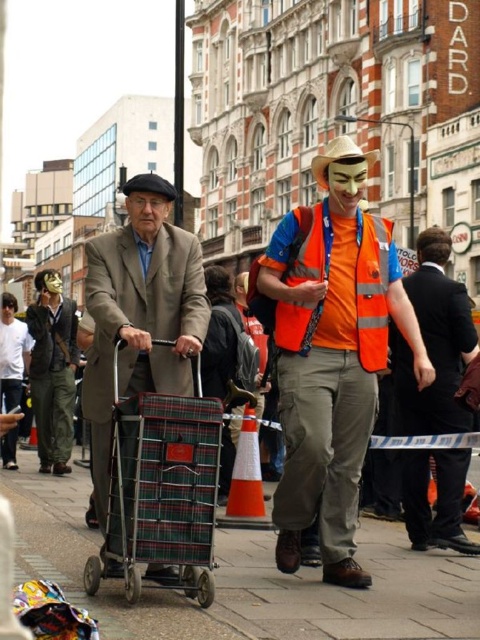
Who is higher up, orange reflective vest at center or matte black mask at lower left?

Positioned higher is matte black mask at lower left.

Does orange reflective vest at center have a greater height compared to matte black mask at lower left?

Correct, orange reflective vest at center is much taller as matte black mask at lower left.

Describe the element at coordinates (433, 342) in the screenshot. I see `orange reflective vest at center` at that location.

Identify the location of orange reflective vest at center. The height and width of the screenshot is (640, 480). (433, 342).

Does matte black mask at center have a larger size compared to matte orange mask at center?

Indeed, matte black mask at center has a larger size compared to matte orange mask at center.

Between matte black mask at center and matte orange mask at center, which one is positioned higher?

matte orange mask at center is higher up.

Describe the element at coordinates (52, 371) in the screenshot. The width and height of the screenshot is (480, 640). I see `matte black mask at center` at that location.

Find the location of a particular element. The height and width of the screenshot is (640, 480). matte black mask at center is located at coordinates pyautogui.click(x=52, y=371).

Does plaid fabric shopping cart at center appear on the right side of orange reflective vest at center?

In fact, plaid fabric shopping cart at center is to the left of orange reflective vest at center.

Which of these two, plaid fabric shopping cart at center or orange reflective vest at center, stands taller?

Standing taller between the two is orange reflective vest at center.

Identify the location of plaid fabric shopping cart at center. (248, 579).